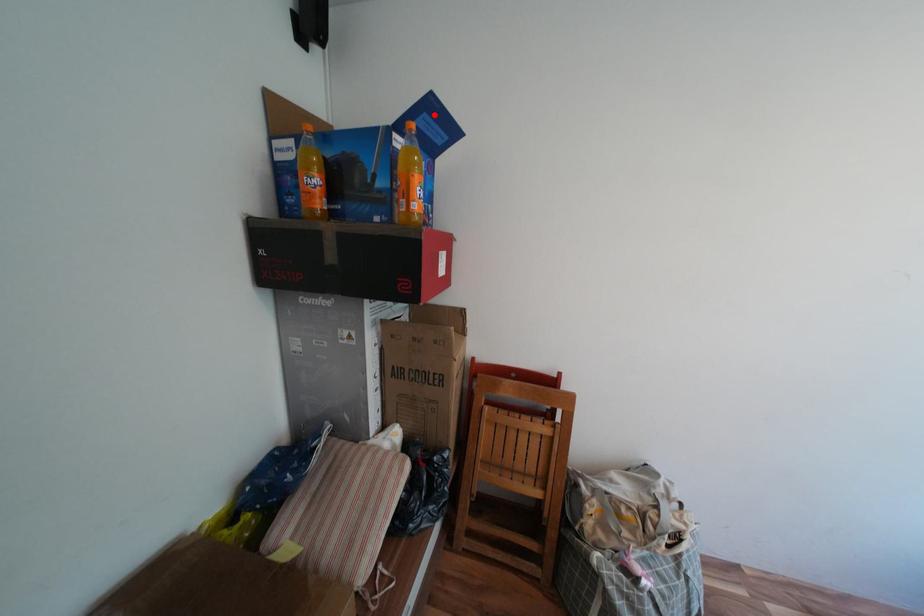
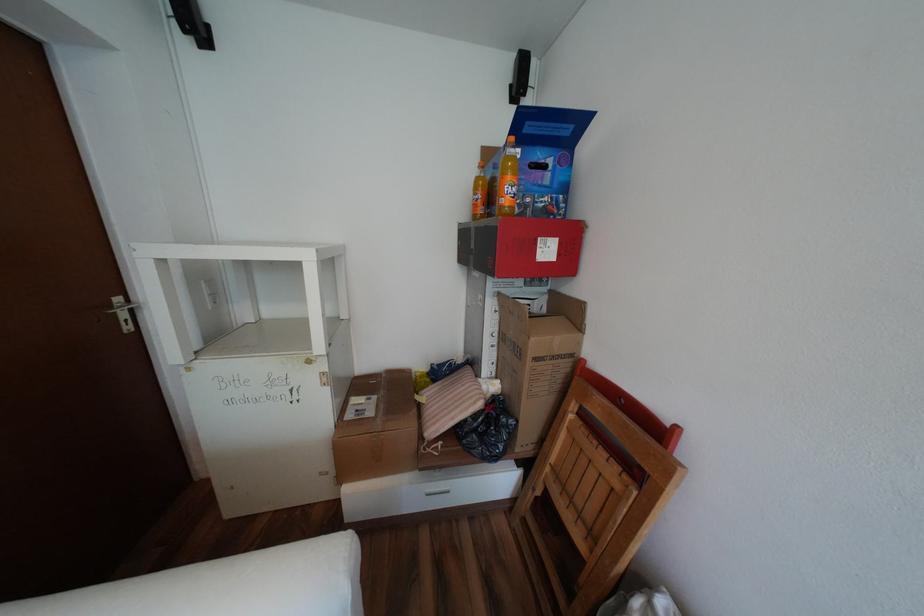
In the second image, find the point that corresponds to the highlighted location in the first image.

(537, 123)